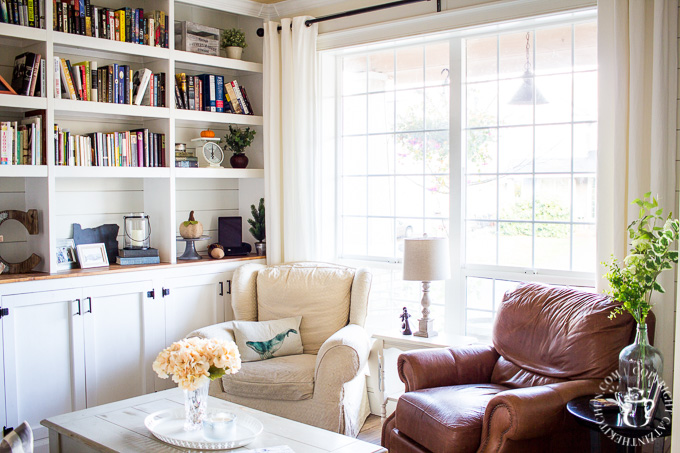
This screenshot has width=680, height=453. What are the coordinates of `white lamp` in the screenshot? It's located at (426, 268).